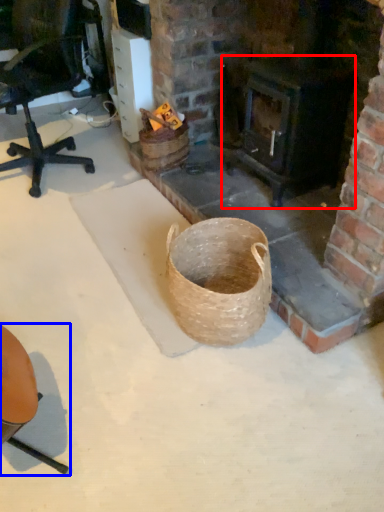
Question: Among these objects, which one is farthest to the camera, stove (highlighted by a red box) or chair (highlighted by a blue box)?

Choices:
 (A) stove
 (B) chair

Answer: (A)